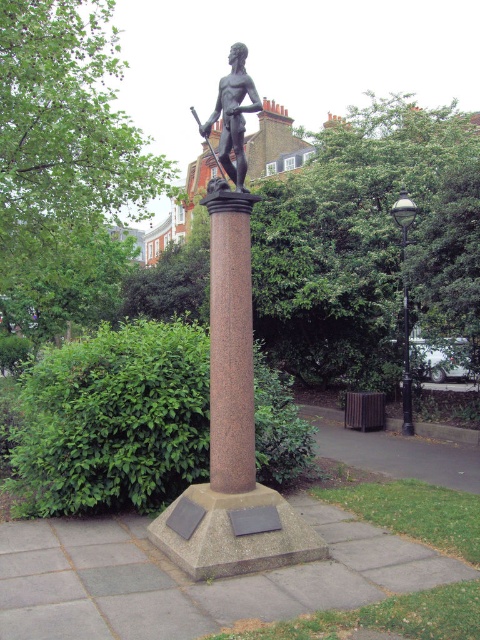
Question: Which point is farther from the camera taking this photo?

Choices:
 (A) (408, 221)
 (B) (253, 483)
 (C) (228, 161)

Answer: (A)

Question: In this image, where is granite column at center located relative to bronze statue at center?

Choices:
 (A) left
 (B) right

Answer: (B)

Question: Among these points, which one is nearest to the camera?

Choices:
 (A) (252, 408)
 (B) (404, 276)

Answer: (A)

Question: Which object is positioned farthest from the granite column at center?

Choices:
 (A) black polished metal lamp post at right
 (B) bronze statue at center

Answer: (A)

Question: Does bronze statue at center have a larger size compared to black polished metal lamp post at right?

Choices:
 (A) yes
 (B) no

Answer: (A)

Question: Is granite column at center behind bronze statue at center?

Choices:
 (A) yes
 (B) no

Answer: (B)